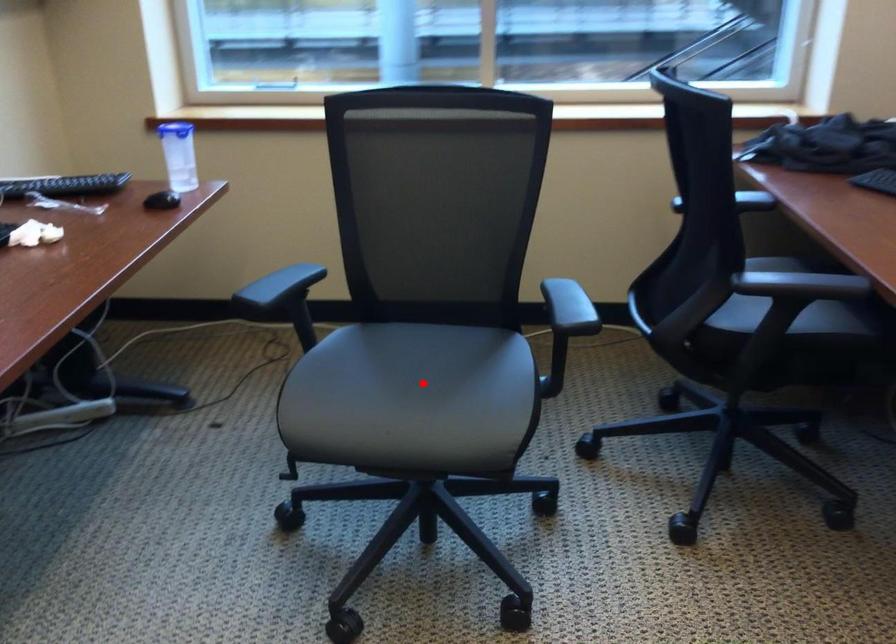
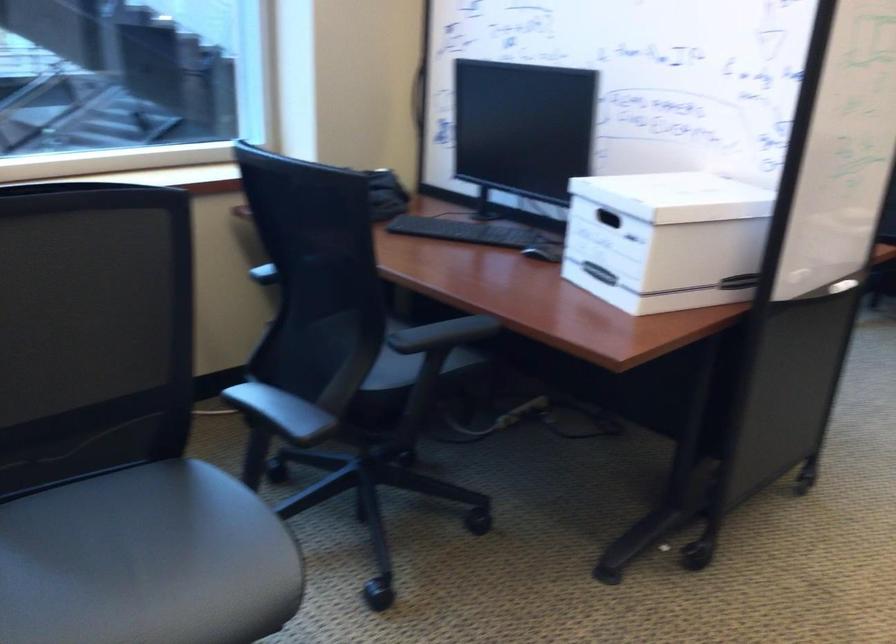
The point at the highlighted location is marked in the first image. Where is the corresponding point in the second image?

(145, 561)